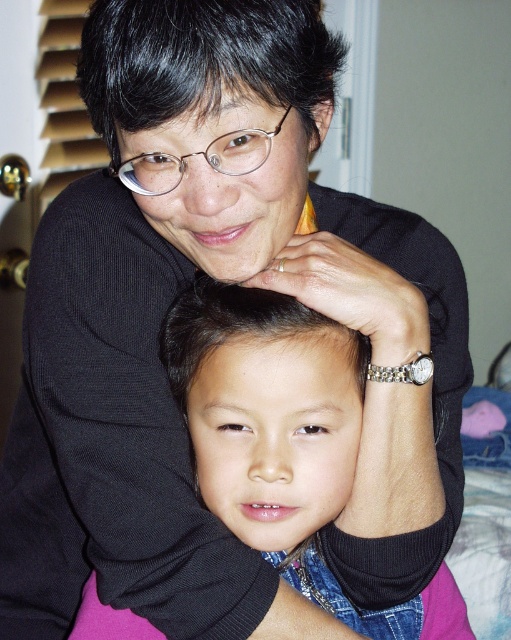
Question: In this image, where is black shiny hair at upper center located relative to clear plastic glasses at center?

Choices:
 (A) below
 (B) above

Answer: (B)

Question: Which point is closer to the camera taking this photo?

Choices:
 (A) (272, 61)
 (B) (169, 358)
 (C) (215, 161)

Answer: (A)

Question: Which object is positioned closest to the black shiny hair at upper center?

Choices:
 (A) black shiny hair at center
 (B) clear plastic glasses at center

Answer: (B)

Question: Among these points, which one is farthest from the camera?

Choices:
 (A) 225,76
 (B) 239,172

Answer: (B)

Question: Is black shiny hair at upper center to the left of black shiny hair at center from the viewer's perspective?

Choices:
 (A) no
 (B) yes

Answer: (B)

Question: Is black shiny hair at center wider than clear plastic glasses at center?

Choices:
 (A) no
 (B) yes

Answer: (B)